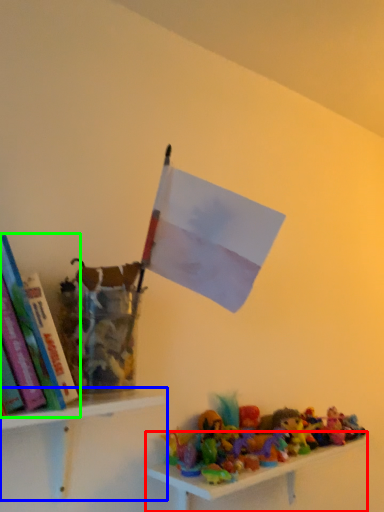
Question: Which is nearer to the shelf (highlighted by a red box)? shelf (highlighted by a blue box) or book (highlighted by a green box).

Choices:
 (A) shelf
 (B) book

Answer: (A)